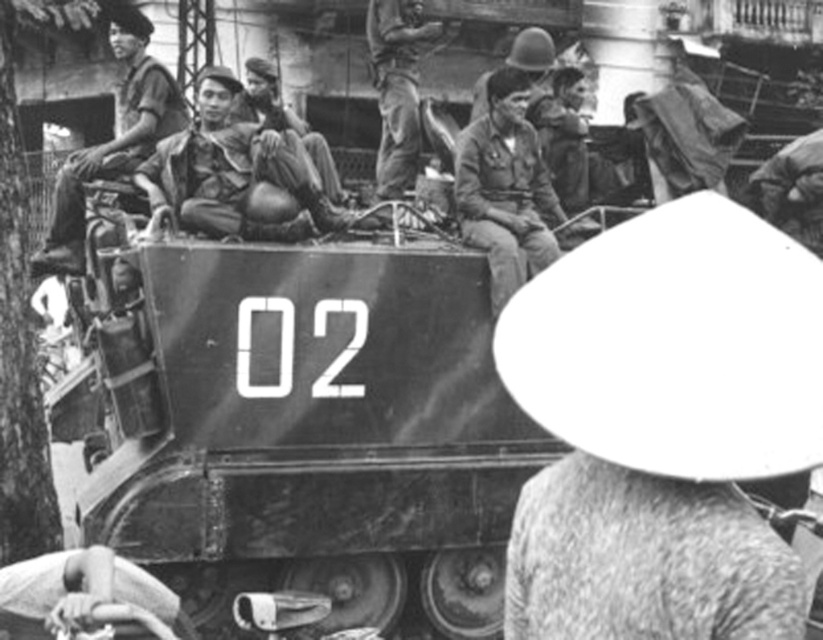
Question: Considering the relative positions of camouflage fabric pants at center and matte khaki uniform at upper left in the image provided, where is camouflage fabric pants at center located with respect to matte khaki uniform at upper left?

Choices:
 (A) right
 (B) left

Answer: (A)

Question: Is metallic tank at center to the left of matte khaki uniform at upper left from the viewer's perspective?

Choices:
 (A) no
 (B) yes

Answer: (A)

Question: Which of the following is the farthest from the observer?

Choices:
 (A) (380, 170)
 (B) (161, 198)

Answer: (A)

Question: Estimate the real-world distances between objects in this image. Which object is closer to the metallic tank at center?

Choices:
 (A) matte khaki uniform at upper left
 (B) camouflage fabric pants at center
 (C) camouflage fabric uniform at center

Answer: (B)

Question: Is the position of camouflage fabric pants at center less distant than that of camouflage fabric uniform at center?

Choices:
 (A) no
 (B) yes

Answer: (B)

Question: Which point appears farthest from the camera in this image?

Choices:
 (A) (377, 179)
 (B) (481, 609)
 (C) (58, 272)
 (D) (473, 205)

Answer: (A)